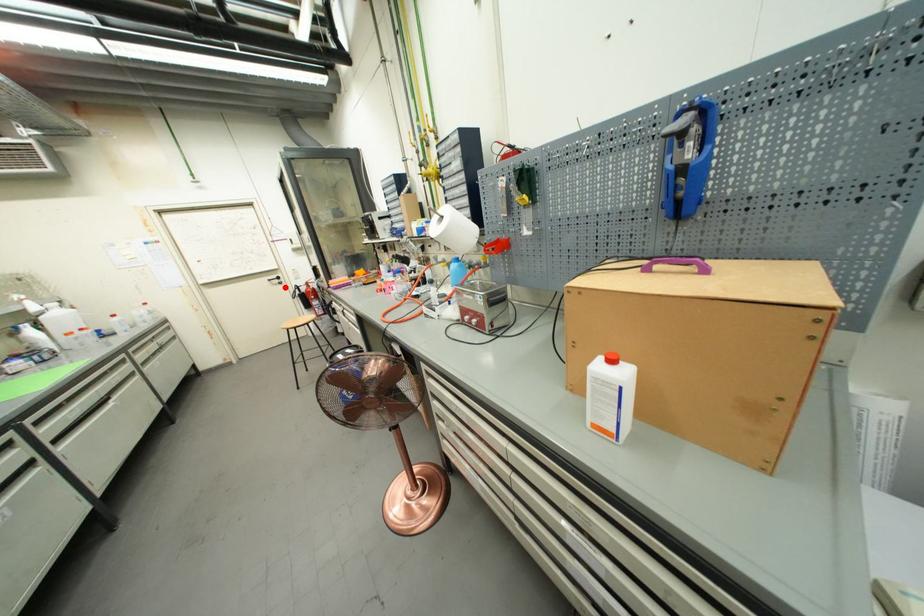
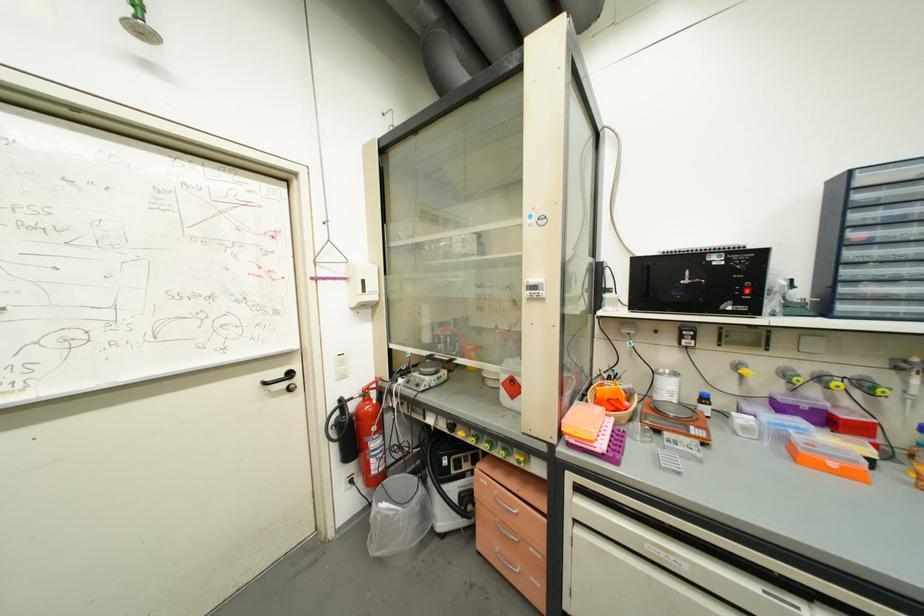
Question: I am providing you with two images of the same scene from different viewpoints. Given a red point in image1, look at the same physical point in image2. Is it:

Choices:
 (A) Closer to the viewpoint
 (B) Farther from the viewpoint

Answer: (B)